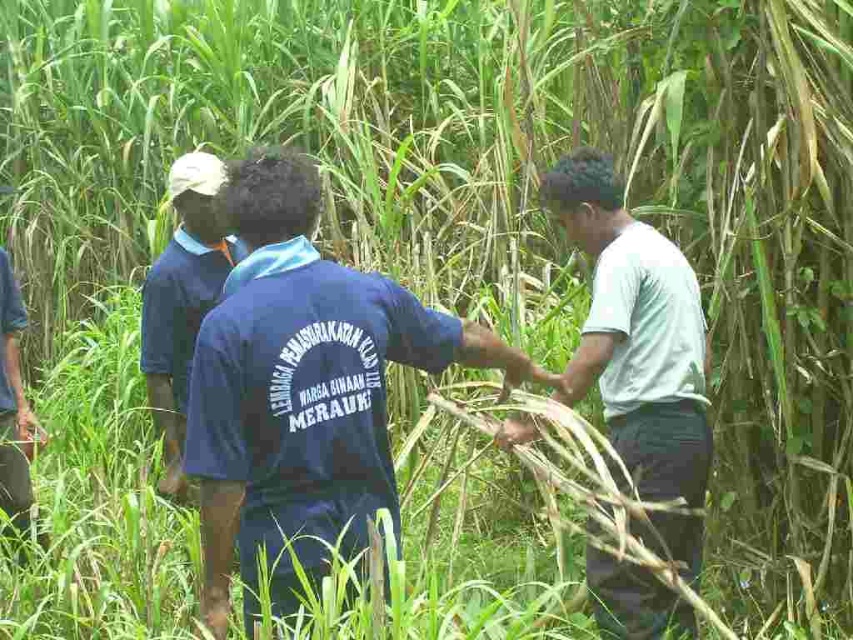
Question: Which of the following is the farthest from the observer?

Choices:
 (A) dark blue shirt at center
 (B) white cotton shirt at right

Answer: (A)

Question: Can you confirm if blue fabric shirt at center is positioned above dark blue shirt at center?

Choices:
 (A) no
 (B) yes

Answer: (A)

Question: Does white cotton shirt at right have a larger size compared to dark blue shirt at center?

Choices:
 (A) no
 (B) yes

Answer: (B)

Question: Does blue fabric shirt at center come behind dark blue shirt at center?

Choices:
 (A) yes
 (B) no

Answer: (B)

Question: Which is nearer to the white cotton shirt at right?

Choices:
 (A) blue fabric shirt at center
 (B) dark blue shirt at center

Answer: (A)

Question: Among these points, which one is farthest from the camera?

Choices:
 (A) (645, 257)
 (B) (355, 426)

Answer: (A)